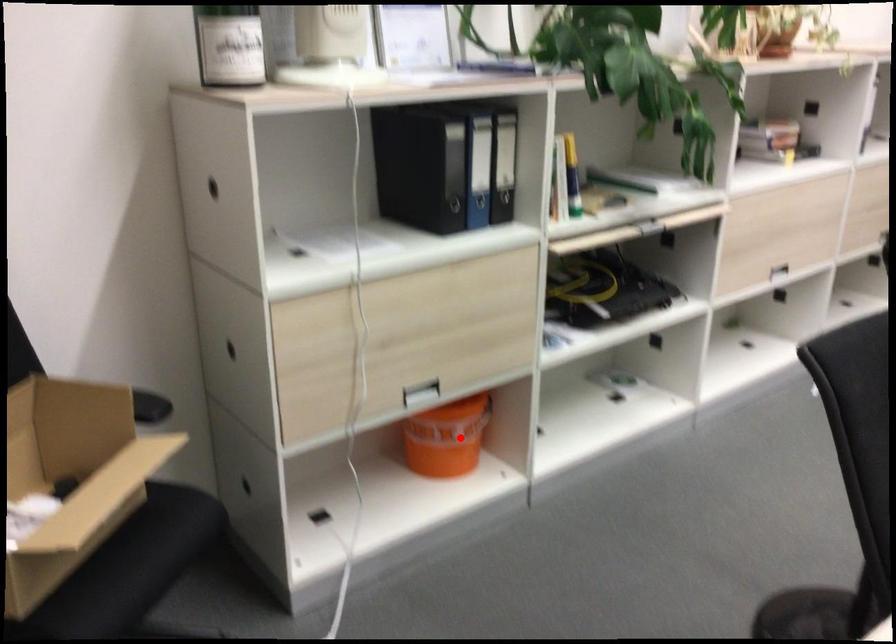
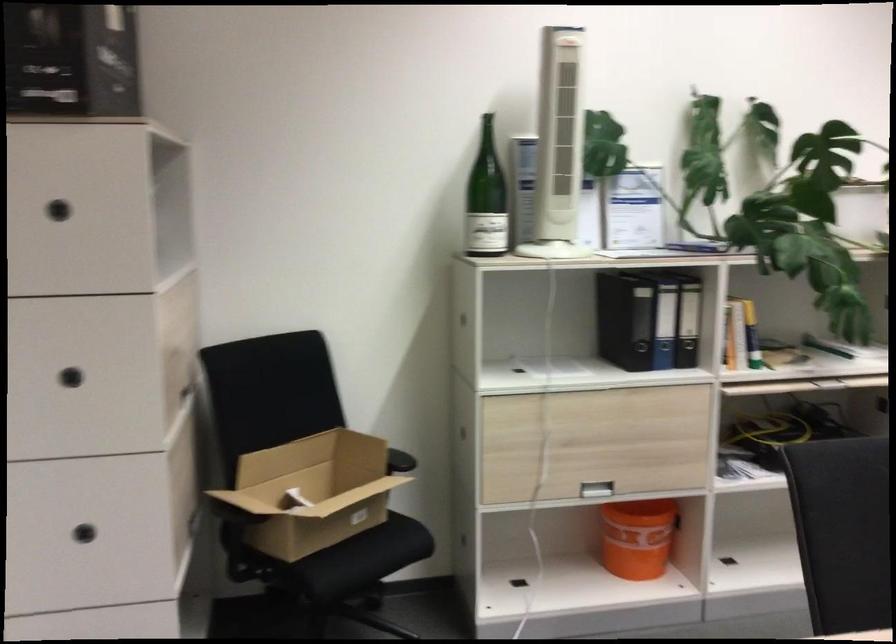
Where in the second image is the point corresponding to the highlighted location from the first image?

(636, 538)